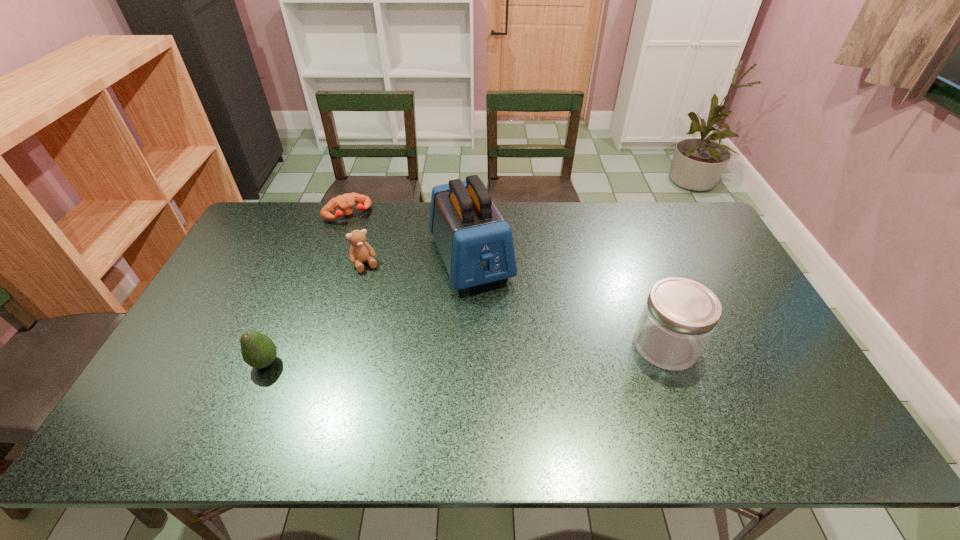
Find the location of `avocado`. avocado is located at coordinates point(258,351).

In order to click on the rightmost object in this screenshot , I will do `click(679, 316)`.

The height and width of the screenshot is (540, 960). What are the coordinates of `the fourth shortest object` in the screenshot? It's located at (679, 316).

Where is `teddy bear`? The width and height of the screenshot is (960, 540). teddy bear is located at coordinates (360, 251).

This screenshot has height=540, width=960. I want to click on the second object from right to left, so (476, 244).

Where is `the tallest object`? This screenshot has height=540, width=960. the tallest object is located at coordinates (476, 244).

Identify the location of the shortest object. (345, 202).

Locate an element on the screen. This screenshot has width=960, height=540. free space located 0.340m on the right of the avocado is located at coordinates (411, 363).

In order to click on vacant space positioned on the left of the second tallest object in this screenshot , I will do `click(540, 346)`.

The height and width of the screenshot is (540, 960). I want to click on free region located 0.240m on the front-facing side of the teddy bear, so click(x=394, y=326).